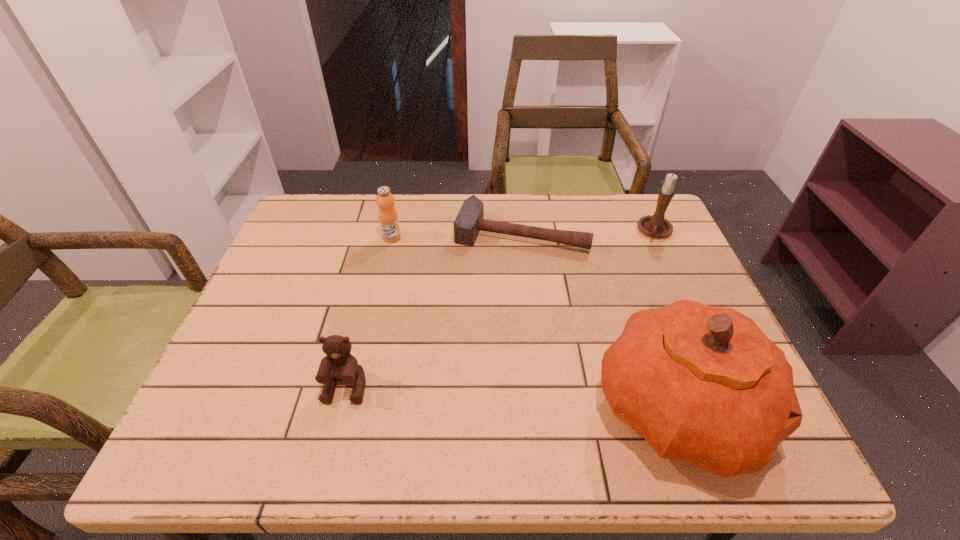
Where is `candle holder that is at the right edge`? This screenshot has height=540, width=960. candle holder that is at the right edge is located at coordinates (656, 226).

Identify the location of object that is positioned at the far right corner. Image resolution: width=960 pixels, height=540 pixels. (656, 226).

The image size is (960, 540). Identify the location of object that is at the near right corner. (702, 384).

You are a GUI agent. You are given a task and a screenshot of the screen. Output one action in this format:
    pyautogui.click(x=<x>, y=<y>)
    Task: Click on the free location at the far edge of the desktop
    
    Given the screenshot: What is the action you would take?
    pyautogui.click(x=502, y=206)

In the image, there is a desktop. Where is `vacant space at the near edge`? This screenshot has width=960, height=540. vacant space at the near edge is located at coordinates (354, 409).

The height and width of the screenshot is (540, 960). I want to click on blank area at the left edge, so click(x=298, y=360).

Locate an element on the screen. vacant space at the far left corner of the desktop is located at coordinates click(x=299, y=222).

Identify the location of vacant area between the shortest object and the second shortest object. (434, 310).

The height and width of the screenshot is (540, 960). In order to click on unoccupied position between the shortest object and the teddy bear in this screenshot , I will do `click(434, 310)`.

The image size is (960, 540). What are the coordinates of `free spot between the candle holder and the teddy bear` in the screenshot? It's located at 501,309.